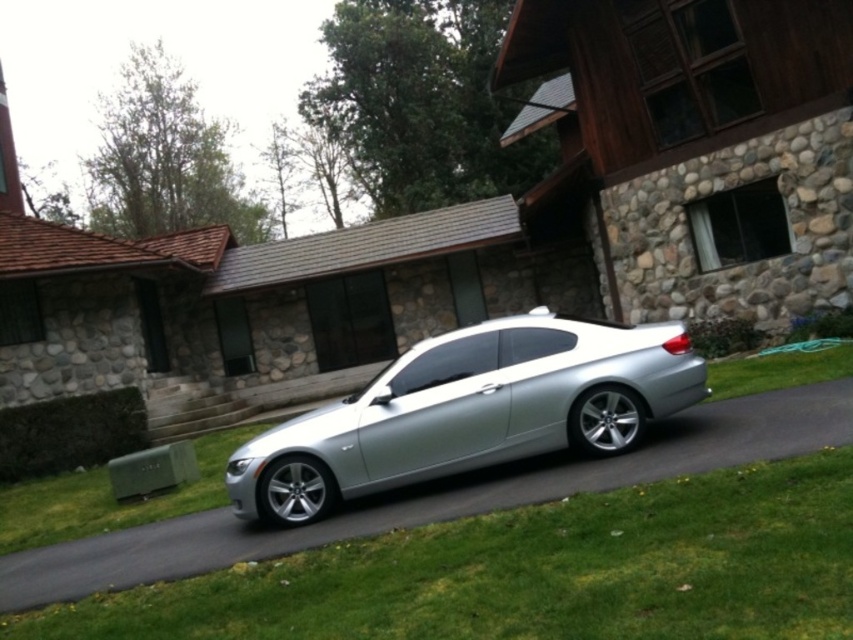
You are a gardener who needs to mow the lawn. You see the green grass at lower right and the satin silver car at center. Which area should you avoid mowing to prevent damaging the car?

You should avoid mowing near the satin silver car at center because the green grass at lower right is shorter than the satin silver car at center, meaning the car is taller and could be hit by the mower.

You are standing in front of the house and see the green grass at lower right and the satin silver car at center. Which object is nearer to you?

The green grass at lower right is closer to the viewer than the satin silver car at center.